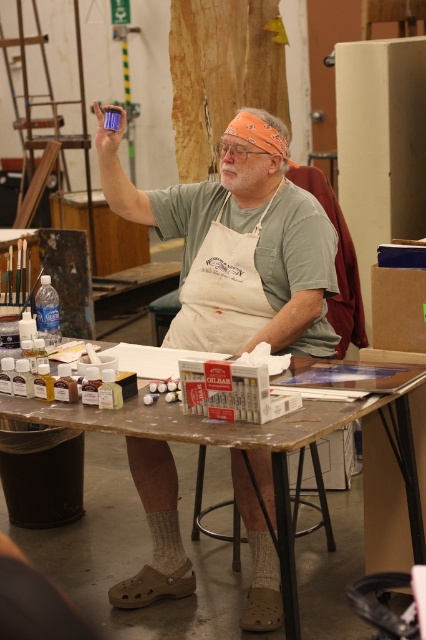
Is matte green shirt at center wider than wooden table at center?

Incorrect, matte green shirt at center's width does not surpass wooden table at center's.

What do you see at coordinates (241, 240) in the screenshot? I see `matte green shirt at center` at bounding box center [241, 240].

The width and height of the screenshot is (426, 640). Find the location of `matte green shirt at center`. matte green shirt at center is located at coordinates (241, 240).